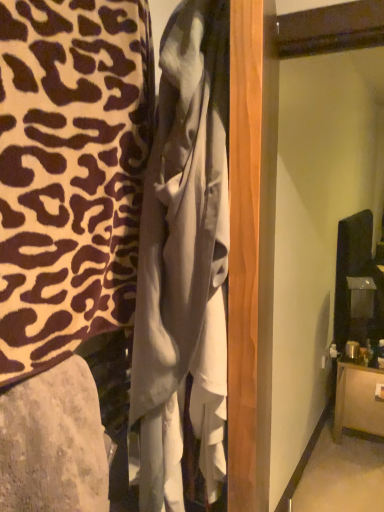
Question: In terms of width, does brown wood cabinet at lower right, the 1th furniture positioned from the bottom, look wider or thinner when compared to matte gray fabric at lower left, the second furniture in the left-to-right sequence?

Choices:
 (A) wide
 (B) thin

Answer: (A)

Question: From their relative heights in the image, would you say brown wood cabinet at lower right, the 1th furniture when ordered from back to front, is taller or shorter than matte gray fabric at lower left, positioned as the second furniture in right-to-left order?

Choices:
 (A) tall
 (B) short

Answer: (A)

Question: Estimate the real-world distances between objects in this image. Which object is farther from the matte gray fabric at lower left, the 2th furniture positioned from the top?

Choices:
 (A) white satin dress at center
 (B) brown wood cabinet at lower right, the 1th furniture when ordered from back to front
 (C) leopard print fabric at left, marked as the 3th furniture in a bottom-to-top arrangement

Answer: (B)

Question: Based on their relative distances, which object is farther from the brown wood cabinet at lower right, the third furniture in the front-to-back sequence?

Choices:
 (A) white satin dress at center
 (B) leopard print fabric at left, arranged as the 1th furniture when viewed from the top
 (C) matte gray fabric at lower left, the 2th furniture positioned from the top

Answer: (C)